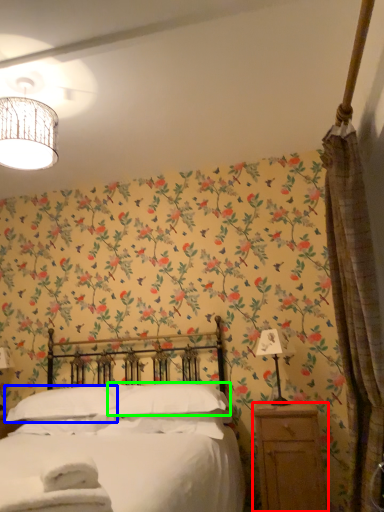
Question: Which is farther away from nightstand (highlighted by a red box)? pillow (highlighted by a blue box) or pillow (highlighted by a green box)?

Choices:
 (A) pillow
 (B) pillow

Answer: (A)